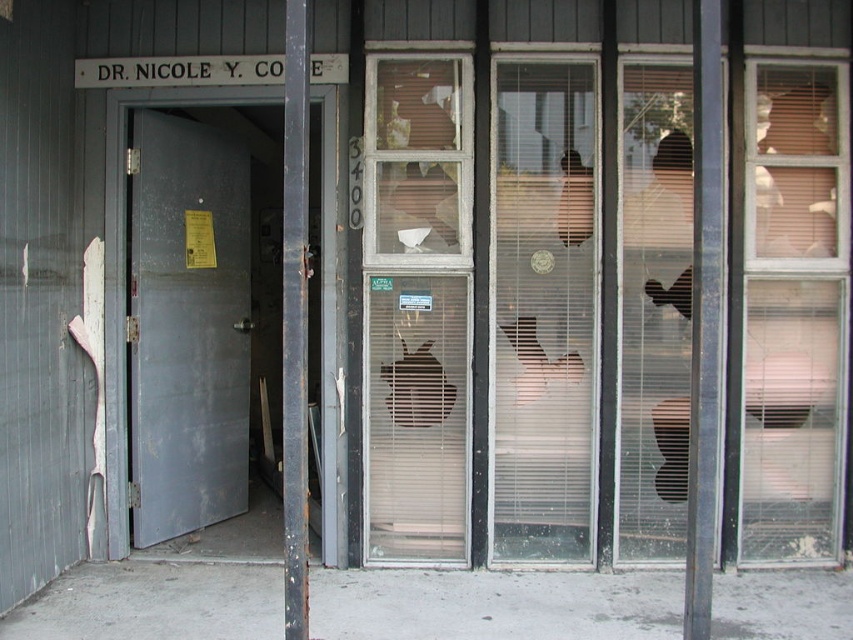
Question: Does clear glass window at right appear under clear glass window at center?

Choices:
 (A) yes
 (B) no

Answer: (A)

Question: Based on their relative distances, which object is farther from the white painted wood sign at upper center?

Choices:
 (A) clear glass window at center
 (B) clear glass window at right
 (C) metallic gray door at left

Answer: (B)

Question: Does clear glass window at right appear under metallic gray door at left?

Choices:
 (A) no
 (B) yes

Answer: (A)

Question: Which of the following is the farthest from the observer?

Choices:
 (A) clear glass window at right
 (B) white painted wood sign at upper center

Answer: (B)

Question: Which is farther from the metallic gray door at left?

Choices:
 (A) clear glass window at center
 (B) white painted wood sign at upper center
 (C) clear glass window at right

Answer: (C)

Question: Can you confirm if metallic gray door at left is positioned below white painted wood sign at upper center?

Choices:
 (A) yes
 (B) no

Answer: (A)